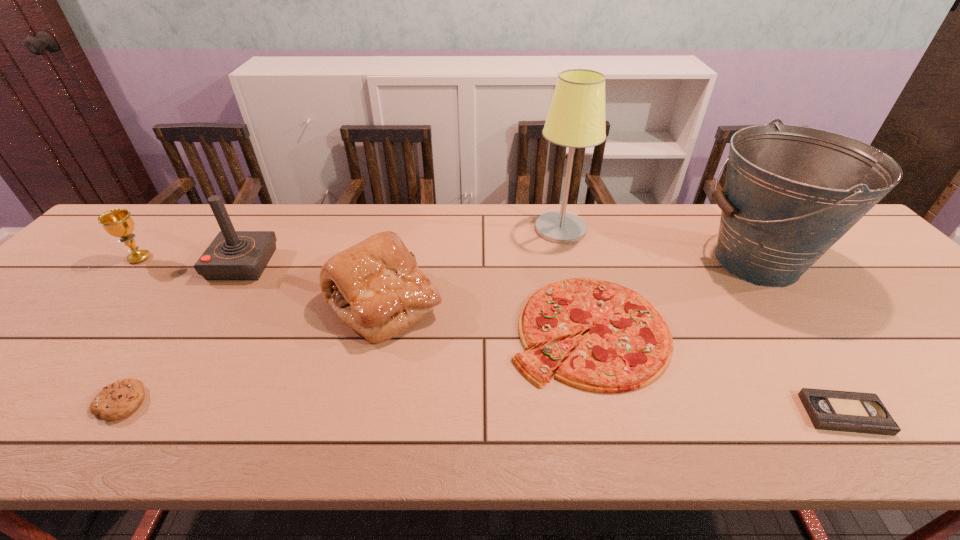
This screenshot has width=960, height=540. What are the coordinates of `joystick that is at the far edge` in the screenshot? It's located at (233, 255).

The width and height of the screenshot is (960, 540). What are the coordinates of `chalice present at the far edge` in the screenshot? It's located at (117, 222).

Where is `cookie located at the near edge`? The height and width of the screenshot is (540, 960). cookie located at the near edge is located at coordinates (119, 399).

This screenshot has height=540, width=960. Find the location of `videotape that is at the near edge`. videotape that is at the near edge is located at coordinates (845, 411).

At what (x,y) coordinates should I click in order to perform the action: click on object situated at the left edge. Please return your answer as a coordinate pair (x, y). The height and width of the screenshot is (540, 960). Looking at the image, I should click on (117, 222).

At what (x,y) coordinates should I click in order to perform the action: click on object that is at the far left corner. Please return your answer as a coordinate pair (x, y). The height and width of the screenshot is (540, 960). Looking at the image, I should click on (117, 222).

Identify the location of free spot at the far edge of the desktop. (418, 224).

This screenshot has height=540, width=960. What are the coordinates of `vacant space at the near edge of the desktop` in the screenshot? It's located at (864, 444).

The image size is (960, 540). In the image, there is a desktop. In order to click on vacant space at the right edge in this screenshot , I will do `click(862, 283)`.

Find the location of `free spot between the seventh tallest object and the third shortest object`. free spot between the seventh tallest object and the third shortest object is located at coordinates tap(355, 366).